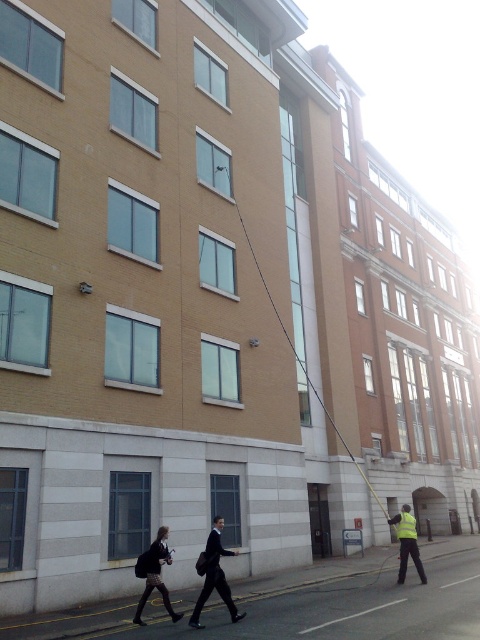
You are a pedestrian standing on the sidewalk and see the dark suit at center and the reflective yellow vest at lower right. Which of these two objects is nearer to you?

The dark suit at center is closer to the viewer than the reflective yellow vest at lower right, so the dark suit at center is nearer to you.

You are a delivery robot with a 1.2 meter wide package. You need to navigate through the space between the dark gray skirt at lower left and the reflective yellow vest at lower right. Can you safely pass through this space without hitting either object?

The distance between the dark gray skirt at lower left and the reflective yellow vest at lower right is 5.95 meters. Since the package is 1.2 meters wide, there is sufficient space for the delivery robot to pass through safely.